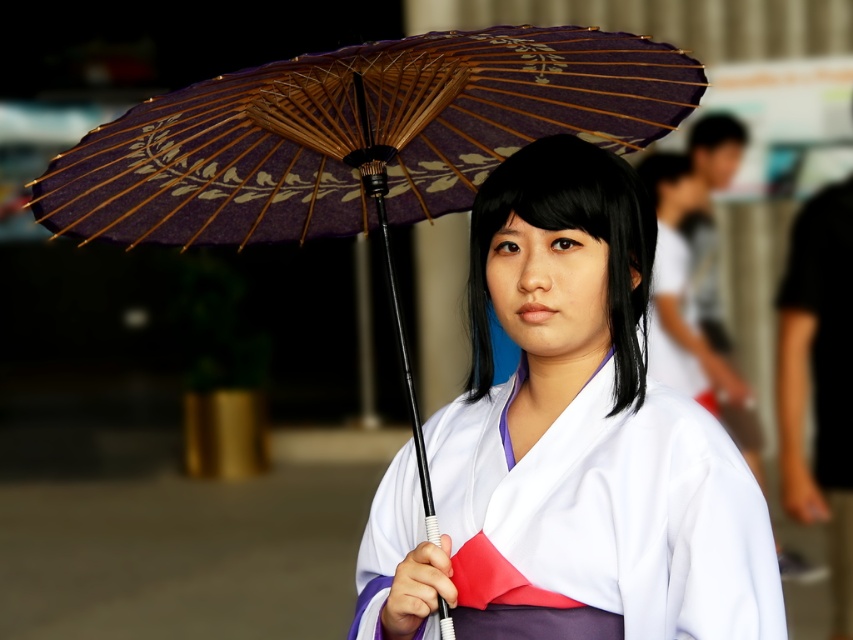
You are a photographer adjusting your camera settings. The subject is wearing a matte purple kimono at center. To ensure the kimono is in focus, where should you position the focus point on the camera screen?

The matte purple kimono at center is located at point (x=570, y=440), so you should position the focus point at those coordinates to ensure the kimono is in focus.

You are a photographer adjusting the lighting for a portrait. You need to ensure both the black matte hair at center and the smooth skin head at upper right are evenly illuminated. Based on their sizes, which object requires more light to appear properly exposed?

The smooth skin head at upper right requires more light because it has a larger width than the black matte hair at center, meaning it covers a bigger area and thus needs more illumination to ensure proper exposure.

You are taking a photo of a person holding an umbrella. You notice two points on the image at coordinates point [665,515] and point [688,198]. Which point is closer to the camera?

Point [665,515] is closer to the camera than point [688,198].